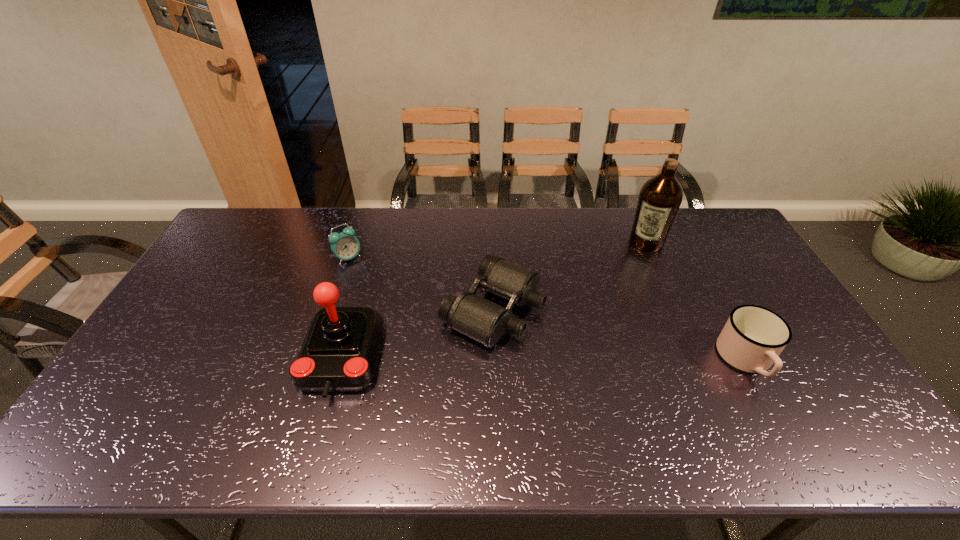
In the image, there is a desktop. In order to click on vacant space at the left edge in this screenshot , I will do tap(171, 345).

At what (x,y) coordinates should I click in order to perform the action: click on free space at the right edge. Please return your answer as a coordinate pair (x, y). The width and height of the screenshot is (960, 540). Looking at the image, I should click on (726, 254).

This screenshot has height=540, width=960. Identify the location of free space at the near right corner of the desktop. (794, 386).

Where is `vacant space in between the joystick and the tallest object`? Image resolution: width=960 pixels, height=540 pixels. vacant space in between the joystick and the tallest object is located at coordinates (494, 300).

Find the location of `free spot between the olive oil and the alarm clock`. free spot between the olive oil and the alarm clock is located at coordinates (497, 250).

Where is `vacant region between the olive oil and the joystick`? The width and height of the screenshot is (960, 540). vacant region between the olive oil and the joystick is located at coordinates (494, 300).

Where is `free point between the joystick and the olive oil`? The height and width of the screenshot is (540, 960). free point between the joystick and the olive oil is located at coordinates (494, 300).

The width and height of the screenshot is (960, 540). What are the coordinates of `empty space between the olive oil and the fourth shortest object` in the screenshot? It's located at (494, 300).

At what (x,y) coordinates should I click in order to perform the action: click on unoccupied area between the alarm clock and the binoculars. Please return your answer as a coordinate pair (x, y). The width and height of the screenshot is (960, 540). Looking at the image, I should click on (420, 284).

Find the location of a particular element. Image resolution: width=960 pixels, height=540 pixels. vacant region between the alarm clock and the mug is located at coordinates (547, 309).